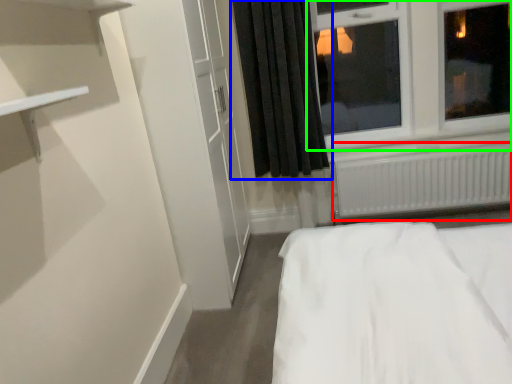
Question: Which object is the closest to the radiator (highlighted by a red box)? Choose among these: curtain (highlighted by a blue box) or window (highlighted by a green box).

Choices:
 (A) curtain
 (B) window

Answer: (B)